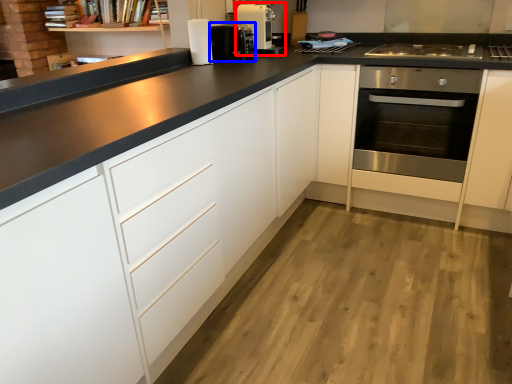
Question: Which point is closer to the camera, home appliance (highlighted by a red box) or coffee machine (highlighted by a blue box)?

Choices:
 (A) home appliance
 (B) coffee machine

Answer: (B)